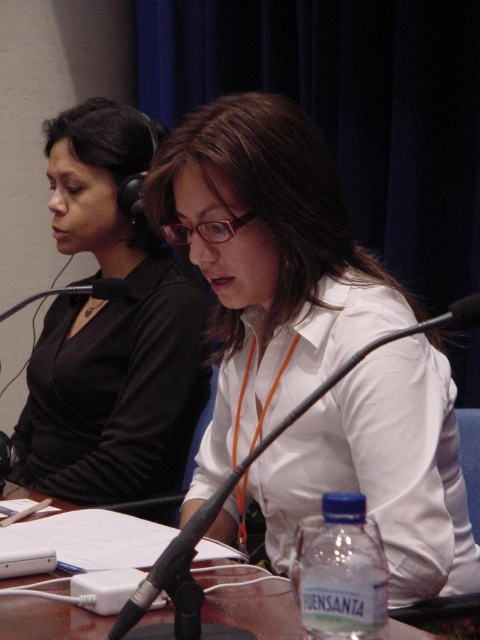
You are standing in front of the table and want to place a small object on the table. You have two options for placement based on the coordinates given. Which coordinate point, point (237, 372) or point (16, 477), is closer to you?

Point (237, 372) is closer to the camera, so placing the object there would be closer to you.

You are attending a virtual meeting and need to identify the speaker based on their clothing. The speaker is wearing a white glossy shirt at center. Where is this shirt positioned relative to the matte black shirt at center?

The white glossy shirt at center is located below the matte black shirt at center.